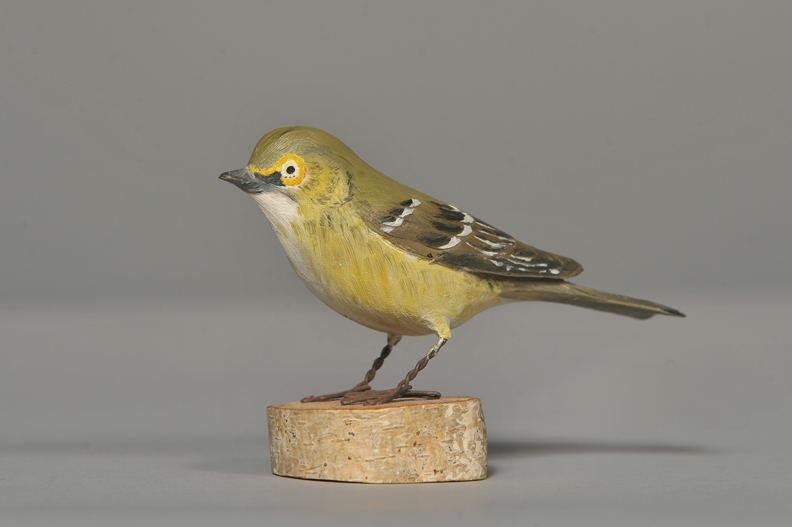
Find the location of `wall`. wall is located at coordinates (136, 182).